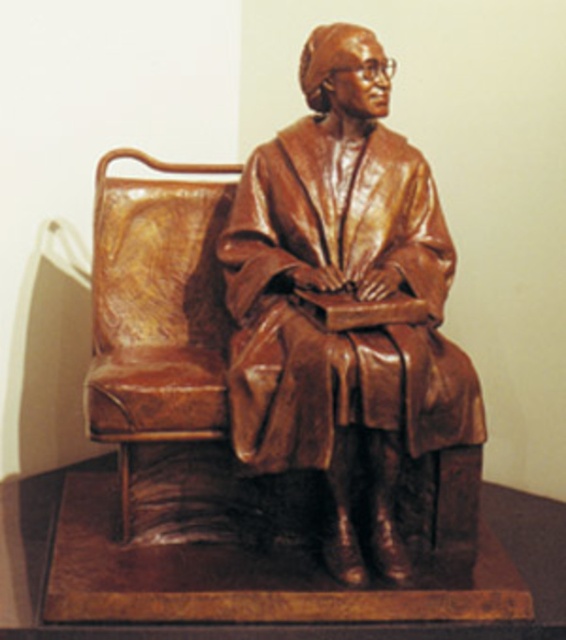
How far apart are bronze statue at center and brown leather armchair at left?

bronze statue at center is 14.59 inches away from brown leather armchair at left.

Where is `bronze statue at center`? bronze statue at center is located at coordinates (345, 292).

Image resolution: width=566 pixels, height=640 pixels. Find the location of `bronze statue at center`. bronze statue at center is located at coordinates (345, 292).